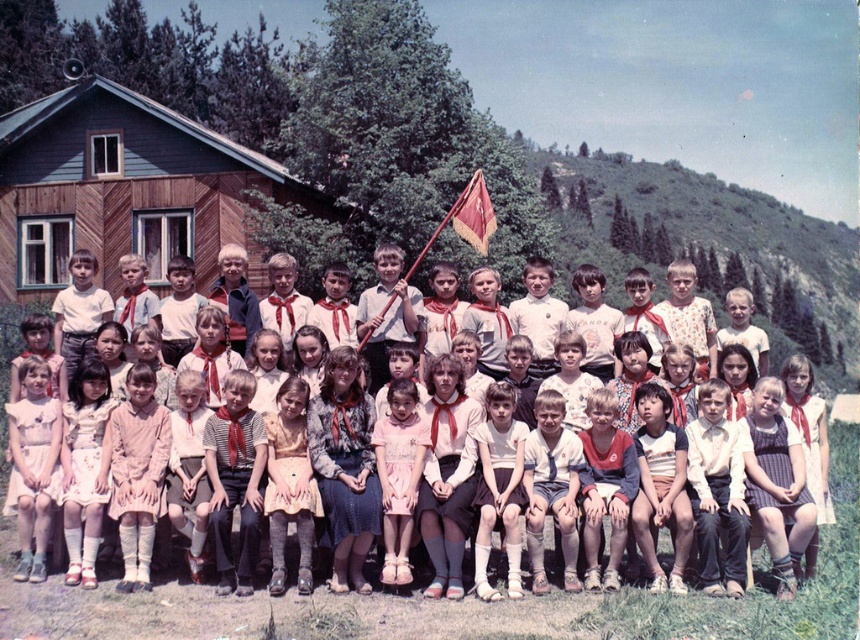
Can you confirm if matte white dress at center is shorter than red velvet flag at center?

Incorrect, matte white dress at center's height does not fall short of red velvet flag at center's.

Is matte white dress at center thinner than red velvet flag at center?

Incorrect, matte white dress at center's width is not less than red velvet flag at center's.

What do you see at coordinates (9, 364) in the screenshot? I see `matte white dress at center` at bounding box center [9, 364].

At what (x,y) coordinates should I click in order to perform the action: click on matte white dress at center. Please return your answer as a coordinate pair (x, y). Image resolution: width=860 pixels, height=640 pixels. Looking at the image, I should click on (9, 364).

Between light yellow fabric dress at center and red velvet flag at center, which one has more height?

Standing taller between the two is light yellow fabric dress at center.

Between point (293, 468) and point (474, 220), which one is positioned behind?

The point (474, 220) is behind.

Which is in front, point (273, 541) or point (470, 202)?

Point (273, 541) is more forward.

Locate an element on the screen. The width and height of the screenshot is (860, 640). light yellow fabric dress at center is located at coordinates coord(290,484).

Is wooden cabin at upper left shorter than light yellow fabric dress at center?

In fact, wooden cabin at upper left may be taller than light yellow fabric dress at center.

Identify the location of wooden cabin at upper left. Image resolution: width=860 pixels, height=640 pixels. (126, 189).